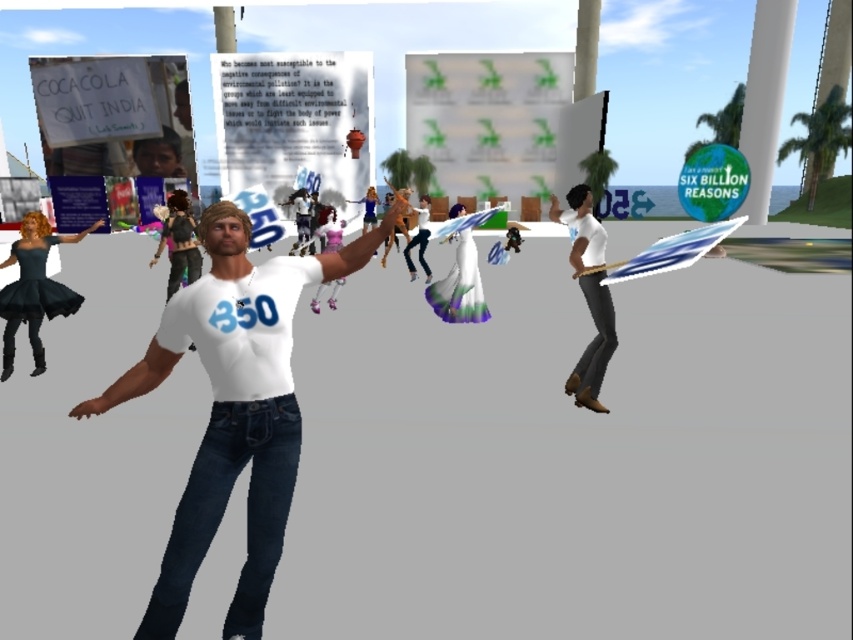
Can you confirm if black leather jacket at center is bigger than matte purple dress at center?

Actually, black leather jacket at center might be smaller than matte purple dress at center.

Which is below, black leather jacket at center or matte purple dress at center?

matte purple dress at center

Is point (190, 273) closer to viewer compared to point (317, 305)?

Yes, point (190, 273) is closer to viewer.

Identify the location of black leather jacket at center. This screenshot has height=640, width=853. (178, 241).

Does black leather jacket at center have a greater width compared to white matte shirt at center?

Yes, black leather jacket at center is wider than white matte shirt at center.

Between black leather jacket at center and white matte shirt at center, which one is positioned lower?

black leather jacket at center is lower down.

Does point (190, 253) come closer to viewer compared to point (415, 244)?

Yes, it is in front of point (415, 244).

Where is `black leather jacket at center`? The image size is (853, 640). black leather jacket at center is located at coordinates (178, 241).

Can you confirm if white matte t-shirt at center is smaller than matte purple dress at center?

Yes.

Between white matte t-shirt at center and matte purple dress at center, which one appears on the right side from the viewer's perspective?

white matte t-shirt at center is more to the right.

The height and width of the screenshot is (640, 853). I want to click on white matte t-shirt at center, so click(234, 406).